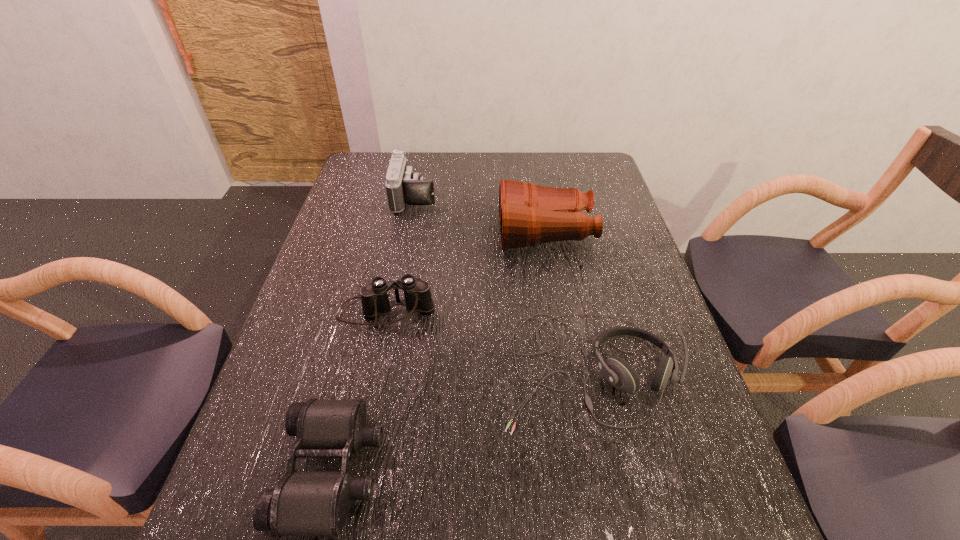
You are a GUI agent. You are given a task and a screenshot of the screen. Output one action in this format:
    pyautogui.click(x=<x>, y=<y>)
    Task: Click on the vacant area located 0.110m on the outer surface of the fourth tallest object
    This screenshot has height=540, width=960.
    Given the screenshot: What is the action you would take?
    pyautogui.click(x=615, y=494)

In order to click on object situated at the far edge in this screenshot , I will do coord(403,185).

The image size is (960, 540). What are the coordinates of `object located in the left edge section of the desktop` in the screenshot? It's located at (374, 297).

Locate an element on the screen. The height and width of the screenshot is (540, 960). binoculars located at the right edge is located at coordinates (529, 214).

Locate an element on the screen. Image resolution: width=960 pixels, height=540 pixels. headset that is at the right edge is located at coordinates (617, 371).

The image size is (960, 540). In the image, there is a desktop. Find the location of `free region at the far edge`. free region at the far edge is located at coordinates (428, 179).

You are a GUI agent. You are given a task and a screenshot of the screen. Output one action in this format:
    pyautogui.click(x=<x>, y=<y>)
    Task: Click on the vacant space at the left edge of the desktop
    The image size is (960, 540).
    Given the screenshot: What is the action you would take?
    pyautogui.click(x=233, y=518)

Where is `free space at the right edge`? This screenshot has height=540, width=960. free space at the right edge is located at coordinates (609, 200).

Locate an element on the screen. free space at the far right corner of the desktop is located at coordinates (591, 159).

I want to click on free point between the tallest binoculars and the headset, so click(x=567, y=300).